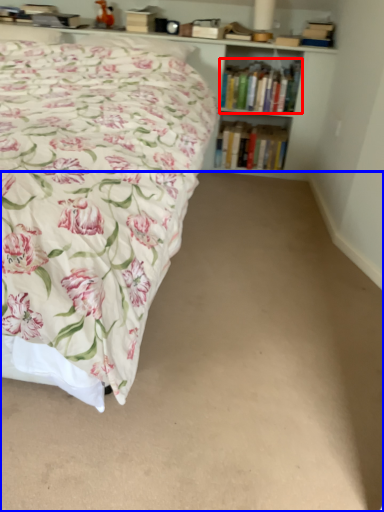
Question: Which point is further to the camera, book (highlighted by a red box) or plain (highlighted by a blue box)?

Choices:
 (A) book
 (B) plain

Answer: (A)